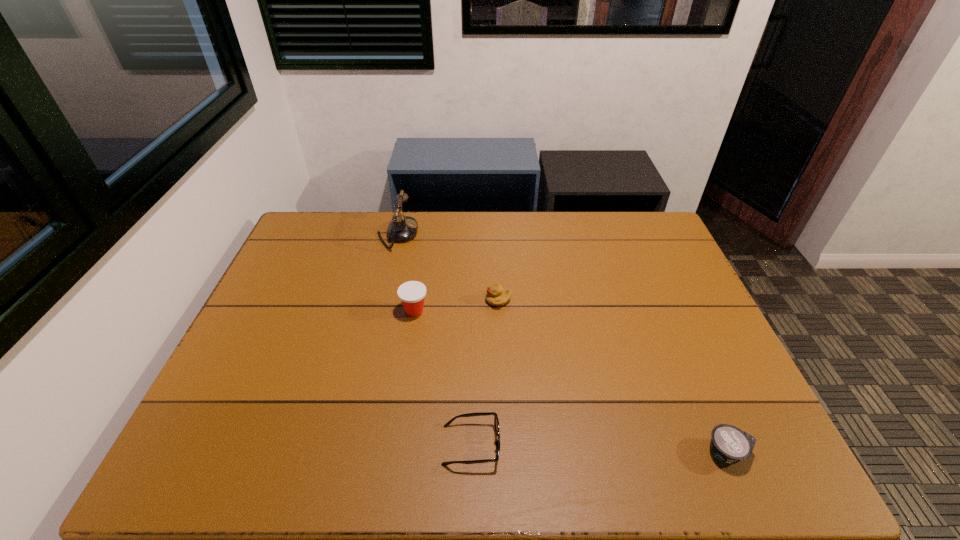
In order to click on vacant space at the left edge of the desktop in this screenshot , I will do `click(272, 372)`.

Locate an element on the screen. free space at the right edge is located at coordinates pos(649,299).

Image resolution: width=960 pixels, height=540 pixels. I want to click on free space at the far left corner of the desktop, so [x=305, y=245].

This screenshot has width=960, height=540. In the image, there is a desktop. Identify the location of vacant region at the near left corner. (211, 452).

The width and height of the screenshot is (960, 540). In order to click on vacant point at the far right corner in this screenshot , I will do `click(658, 246)`.

This screenshot has width=960, height=540. In the image, there is a desktop. Find the location of `vacant space at the near right corner`. vacant space at the near right corner is located at coordinates point(745,464).

Locate an element on the screen. free spot between the spectacles and the tallest object is located at coordinates (434, 340).

The image size is (960, 540). Find the location of `free space that is in between the spectacles and the duckling`. free space that is in between the spectacles and the duckling is located at coordinates (485, 373).

Identify the location of vacant point located between the third shortest object and the tallest object. pos(447,267).

You are a GUI agent. You are given a task and a screenshot of the screen. Output one action in this format:
    pyautogui.click(x=<x>, y=<y>)
    Task: Click on the free space between the duckling and the Dixie cup
    Image resolution: width=960 pixels, height=540 pixels.
    Given the screenshot: What is the action you would take?
    pyautogui.click(x=456, y=306)